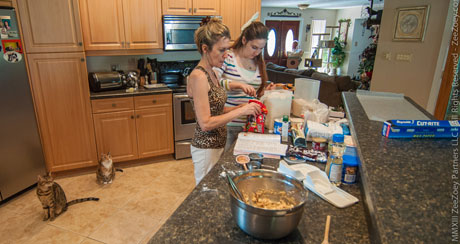
The image size is (460, 244). Find the location of `counter`. counter is located at coordinates (437, 183), (216, 217), (116, 96).